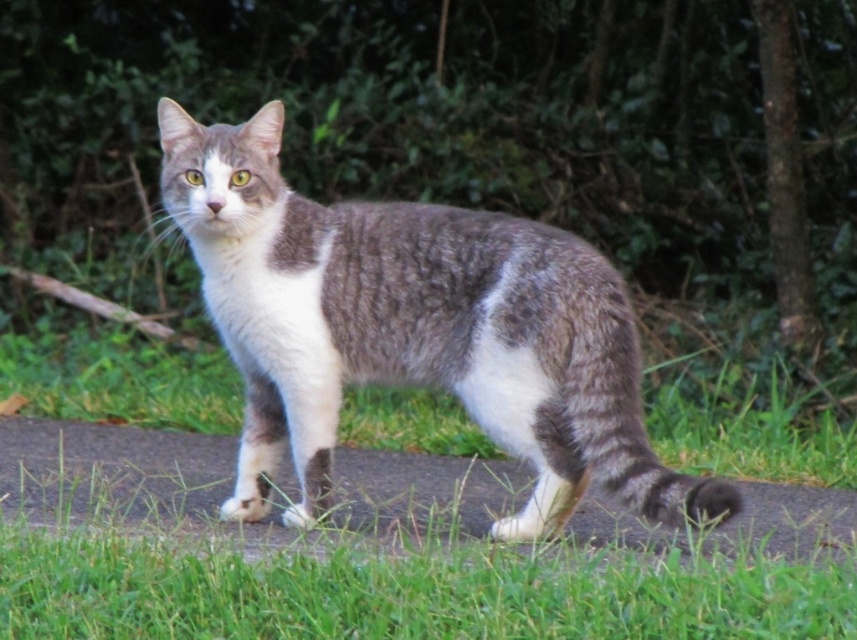
You are a photographer trying to capture the gray tabby cat at center and the gray asphalt at center in a single shot. Which object is closer to your camera lens?

The gray tabby cat at center is closer to the camera lens because it is positioned further to the viewer than the gray asphalt at center.

You are a photographer trying to capture the cat in the scene. The gray asphalt at center is represented by point (231, 484). Where should you position your camera relative to this point to ensure the cat is centered in your shot?

To center the cat in your shot, position your camera directly at the gray asphalt at center represented by point (231, 484), as this point marks the central location of the cat in the scene.

You are a photographer trying to capture the gray tabby cat at center and the gray asphalt at center in a single shot. Which object is taller when viewed from your camera position?

The gray tabby cat at center is taller than the gray asphalt at center.